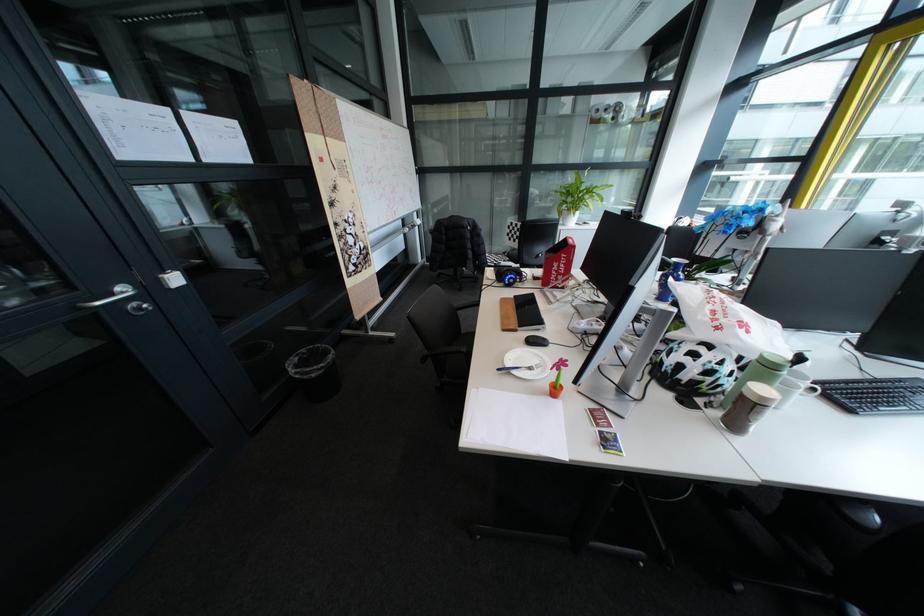
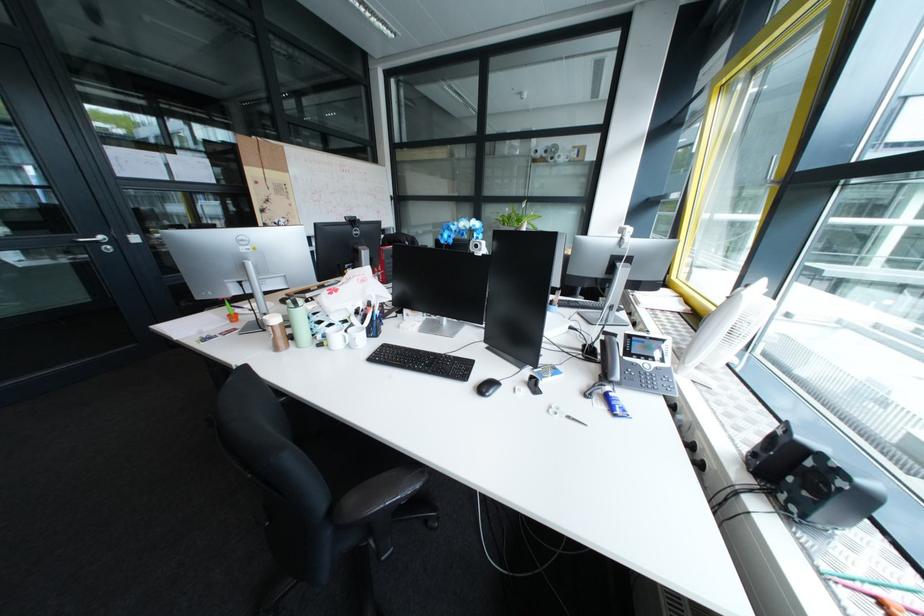
Question: I am providing you with two images of the same scene from different viewpoints. Please identify which objects are invisible in image2.

Choices:
 (A) small fork
 (B) glass perfume bottle
 (C) brown shaker cup
 (D) white handled scissors

Answer: (A)